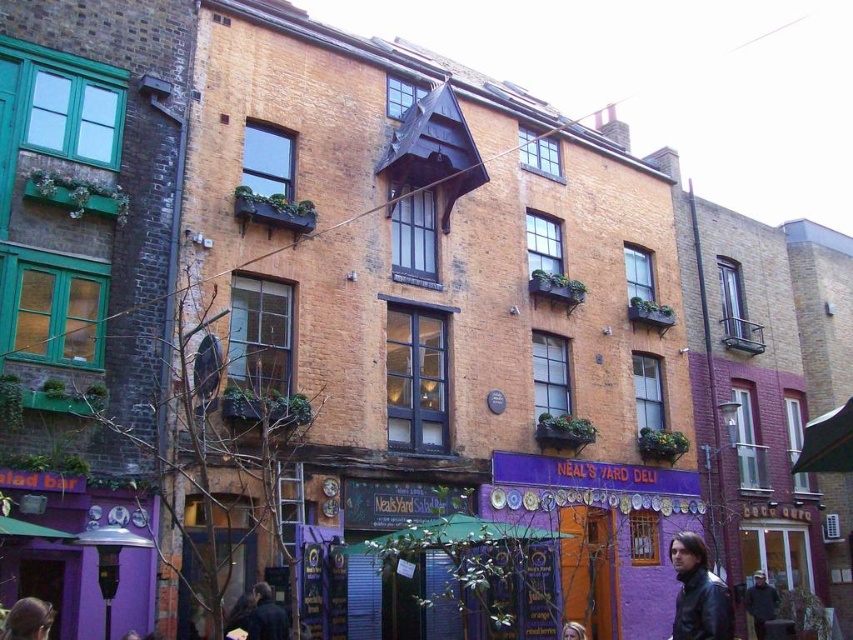
In the scene shown: You are standing in front of the central building and want to locate two specific points marked on the facade. The first point is at coordinates point (x=706, y=605) and the second is at point (x=279, y=605). Which of these points appears closer to you?

Point (x=706, y=605) is closer to the viewer than point (x=279, y=605).

You are a pedestrian standing in the street scene. You see a black leather jacket at lower right and a dark brown hair at lower left. Which object is positioned lower in the image?

The black leather jacket at lower right is positioned below the dark brown hair at lower left, so it is lower in the image.

You are a customer at Neal s Yard Deli and you see two jackets hanging on the wall outside the store. Which jacket is closer to you, the black leather jacket at lower right or the dark blue jacket at lower left?

The black leather jacket at lower right is closer to you because it is in front of the dark blue jacket at lower left.